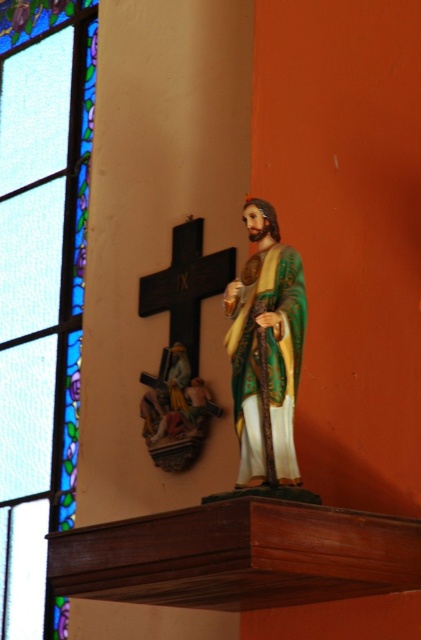
Is stained glass at upper left further to the viewer compared to brown polished wood altar at center?

Yes, stained glass at upper left is further from the viewer.

In the scene shown: Is stained glass at upper left smaller than brown polished wood altar at center?

Incorrect, stained glass at upper left is not smaller in size than brown polished wood altar at center.

Where is `stained glass at upper left`? This screenshot has width=421, height=640. stained glass at upper left is located at coordinates (40, 285).

Can you confirm if stained glass at upper left is taller than shiny green statue at center?

Yes, stained glass at upper left is taller than shiny green statue at center.

Does stained glass at upper left come in front of shiny green statue at center?

No.

Is point (23, 308) farther from camera compared to point (266, 426)?

Yes.

Where is `stained glass at upper left`? stained glass at upper left is located at coordinates (40, 285).

Between brown polished wood altar at center and shiny green statue at center, which one appears on the right side from the viewer's perspective?

From the viewer's perspective, shiny green statue at center appears more on the right side.

Based on the photo, is brown polished wood altar at center closer to the viewer compared to shiny green statue at center?

Yes, it is in front of shiny green statue at center.

The image size is (421, 640). Identify the location of brown polished wood altar at center. (237, 556).